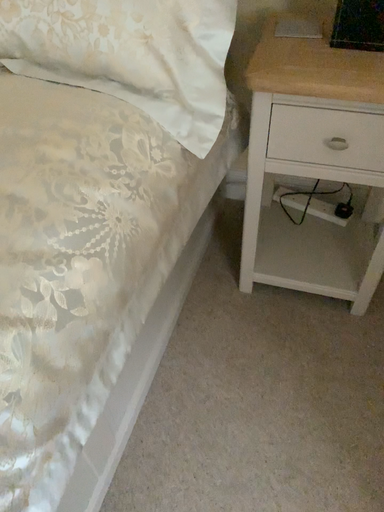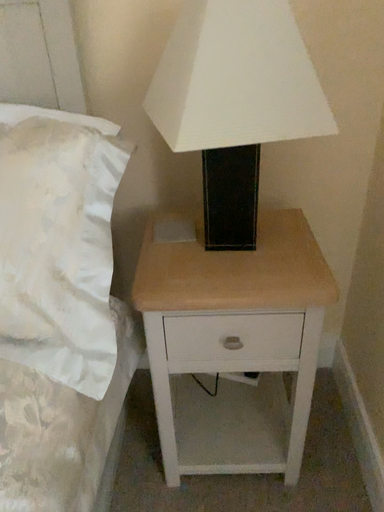
Question: How did the camera likely rotate when shooting the video?

Choices:
 (A) rotated downward
 (B) rotated upward

Answer: (B)